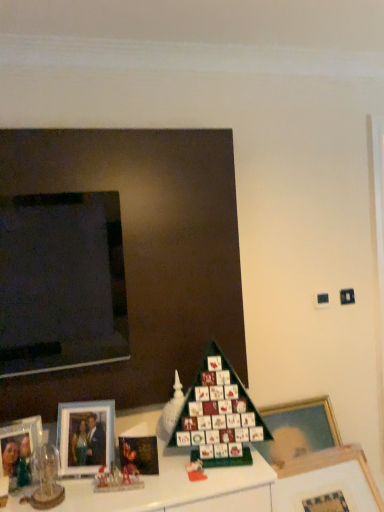
Locate an element on the screen. The width and height of the screenshot is (384, 512). free space in front of matte black picture frame at lower left, placed as the 3th picture frame when sorted from left to right is located at coordinates (138, 489).